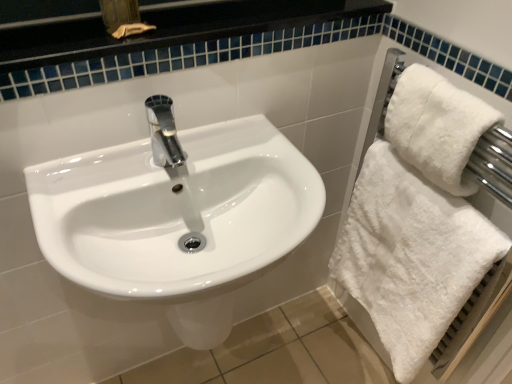
This screenshot has width=512, height=384. Identify the location of free space above white fluffy towel at right (from a real-world perspective). (422, 178).